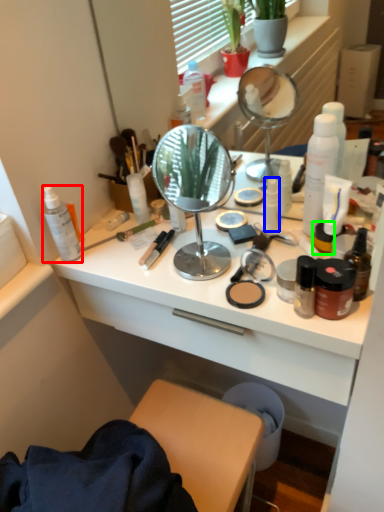
Question: Which is nearer to the toiletry (highlighted by a red box)? toiletry (highlighted by a blue box) or toiletry (highlighted by a green box).

Choices:
 (A) toiletry
 (B) toiletry

Answer: (A)